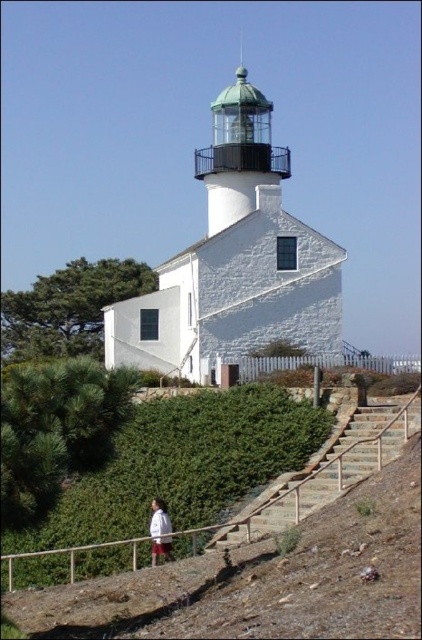
Consider the image. You are standing at the base of the lighthouse and want to find the brown wooden rail at lower center. According to the coordinates provided, where should you look to locate it?

The brown wooden rail at lower center is located at coordinates point (314, 477).

You are a visitor approaching the lighthouse and want to reach the paved area at the top. You see the brown wooden rail at lower center and the brown stone stairs at lower right. Which object should you use to ascend towards the lighthouse?

The brown stone stairs at lower right should be used to ascend towards the lighthouse since the brown wooden rail at lower center is located below them, indicating the stairs are the path leading upwards.